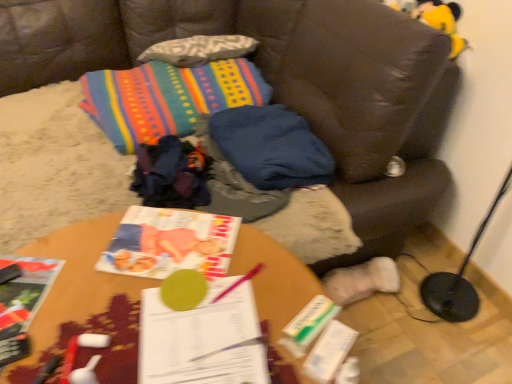
Where is `free spot to the right of matte paper book at center, which is counted as the 2th book, starting from the right`? free spot to the right of matte paper book at center, which is counted as the 2th book, starting from the right is located at coordinates (268, 269).